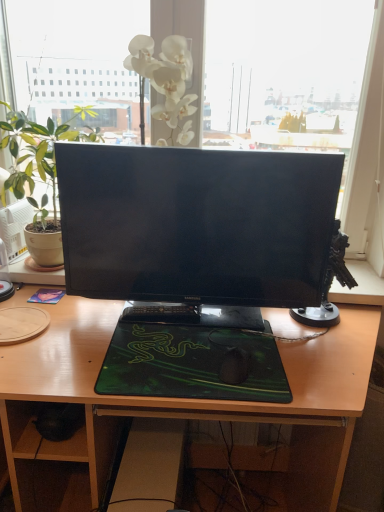
Question: Can you confirm if green matte mousepad at center is positioned to the right of wooden desk at center?

Choices:
 (A) no
 (B) yes

Answer: (B)

Question: Can you confirm if green matte mousepad at center is positioned to the left of wooden desk at center?

Choices:
 (A) no
 (B) yes

Answer: (A)

Question: From a real-world perspective, does green matte mousepad at center stand above wooden desk at center?

Choices:
 (A) yes
 (B) no

Answer: (A)

Question: Is wooden desk at center inside green matte mousepad at center?

Choices:
 (A) no
 (B) yes

Answer: (A)

Question: Is green matte mousepad at center positioned with its back to wooden desk at center?

Choices:
 (A) yes
 (B) no

Answer: (A)

Question: Looking at the image, does black plastic keyboard at center seem bigger or smaller compared to black glossy monitor at center?

Choices:
 (A) big
 (B) small

Answer: (B)

Question: From a real-world perspective, is black plastic keyboard at center physically located above or below black glossy monitor at center?

Choices:
 (A) below
 (B) above

Answer: (A)

Question: Does point (173, 321) appear closer or farther from the camera than point (183, 265)?

Choices:
 (A) closer
 (B) farther

Answer: (A)

Question: Looking at their shapes, would you say black plastic keyboard at center is wider or thinner than black glossy monitor at center?

Choices:
 (A) thin
 (B) wide

Answer: (A)

Question: In terms of height, does black plastic keyboard at center look taller or shorter compared to green matte mousepad at center?

Choices:
 (A) short
 (B) tall

Answer: (B)

Question: Which is correct: black plastic keyboard at center is inside green matte mousepad at center, or outside of it?

Choices:
 (A) inside
 (B) outside

Answer: (B)

Question: In the image, is black plastic keyboard at center positioned in front of or behind green matte mousepad at center?

Choices:
 (A) behind
 (B) front

Answer: (A)

Question: Is point pyautogui.click(x=147, y=309) closer or farther from the camera than point pyautogui.click(x=167, y=385)?

Choices:
 (A) farther
 (B) closer

Answer: (A)

Question: Is point (225, 358) positioned closer to the camera than point (39, 224)?

Choices:
 (A) closer
 (B) farther

Answer: (A)

Question: Is black matte mouse at center to the left or to the right of green matte houseplant at left in the image?

Choices:
 (A) left
 (B) right

Answer: (B)